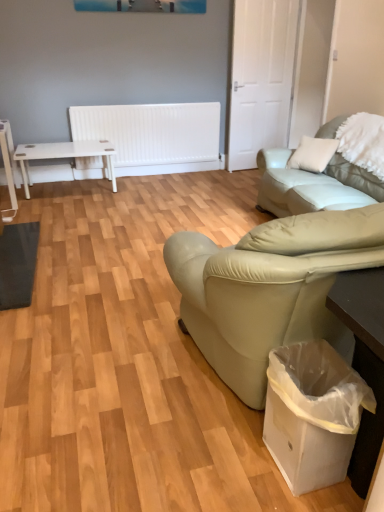
Question: Is white fluffy pillow at upper right taller or shorter than leather couch at right?

Choices:
 (A) tall
 (B) short

Answer: (B)

Question: In the image, is white fluffy pillow at upper right on the left side or the right side of leather couch at right?

Choices:
 (A) left
 (B) right

Answer: (B)

Question: Considering the real-world distances, which object is farthest from the leather couch at right?

Choices:
 (A) white plastic table at lower right, arranged as the 1th table when viewed from the right
 (B) white fluffy pillow at upper right
 (C) white plastic bag at lower right
 (D) white glossy table at left, the first table from the left

Answer: (D)

Question: Considering the real-world distances, which object is farthest from the white plastic table at lower right, placed as the first table when sorted from front to back?

Choices:
 (A) white glossy table at left, placed as the second table when sorted from front to back
 (B) leather couch at right
 (C) white plastic bag at lower right
 (D) white fluffy pillow at upper right

Answer: (A)